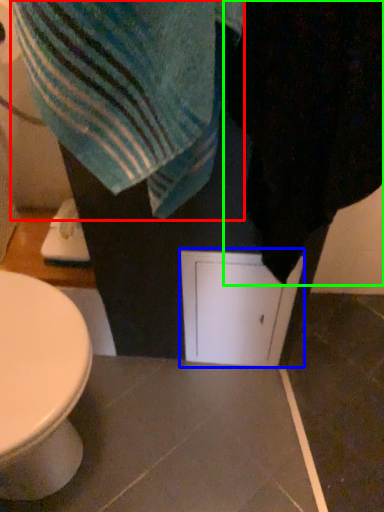
Question: Which is nearer to the beach towel (highlighted by a red box)? screen door (highlighted by a blue box) or bath towel (highlighted by a green box).

Choices:
 (A) screen door
 (B) bath towel

Answer: (B)